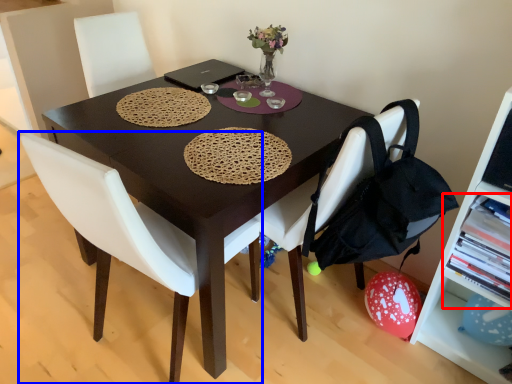
Question: Which of the following is the closest to the observer, shelf (highlighted by a red box) or chair (highlighted by a blue box)?

Choices:
 (A) shelf
 (B) chair

Answer: (B)